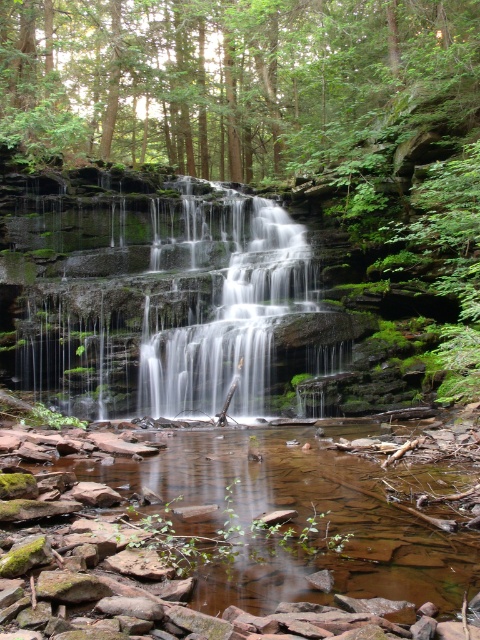
Question: Does brown rock stream at lower center have a smaller size compared to smooth gray rock waterfall at center?

Choices:
 (A) yes
 (B) no

Answer: (A)

Question: Which of the following is the closest to the observer?

Choices:
 (A) (212, 433)
 (B) (216, 28)

Answer: (A)

Question: Which object is farther from the camera taking this photo?

Choices:
 (A) smooth gray rock waterfall at center
 (B) green leafy tree at upper center

Answer: (B)

Question: In this image, where is brown rock stream at lower center located relative to smooth gray rock waterfall at center?

Choices:
 (A) below
 (B) above

Answer: (A)

Question: Which of these objects is positioned farthest from the smooth gray rock waterfall at center?

Choices:
 (A) green leafy tree at upper center
 (B) brown rock stream at lower center

Answer: (B)

Question: Is the position of brown rock stream at lower center more distant than that of green leafy tree at upper center?

Choices:
 (A) yes
 (B) no

Answer: (B)